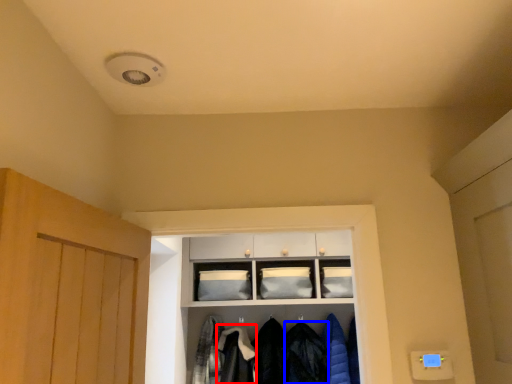
Question: Which object is closer to the camera taking this photo, clothing (highlighted by a red box) or clothing (highlighted by a blue box)?

Choices:
 (A) clothing
 (B) clothing

Answer: (A)